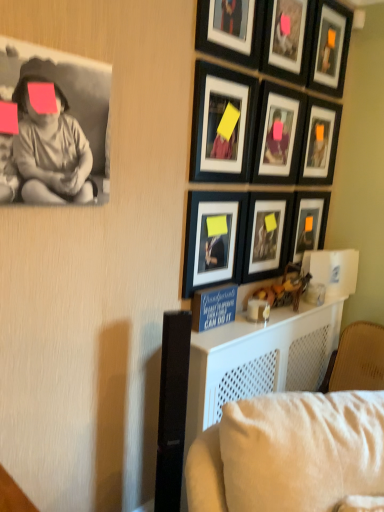
The height and width of the screenshot is (512, 384). In order to click on matte black picture frame at upper center, the sixth picture frame when ordered from top to bottom in this screenshot , I will do `click(219, 123)`.

Consider the image. How much space does matte black picture frame at center, acting as the 8th picture frame starting from the top, occupy horizontally?

It is 4.76 centimeters.

Measure the distance between point (327, 206) and camera.

Point (327, 206) is 2.43 meters from camera.

Describe the element at coordinates (51, 152) in the screenshot. I see `matte black photo of child at upper left` at that location.

The image size is (384, 512). In order to click on matte black picture frame at upper right, the ninth picture frame when ordered from bottom to top in this screenshot , I will do `click(330, 48)`.

What are the coordinates of `matte black picture frame at upper center, arranged as the fourth picture frame when ordered from the bottom` in the screenshot? It's located at (219, 123).

Between matte black picture frame at upper center, arranged as the fourth picture frame when ordered from the bottom, and matte black picture frame at center, acting as the 8th picture frame starting from the top, which one appears on the left side from the viewer's perspective?

matte black picture frame at upper center, arranged as the fourth picture frame when ordered from the bottom.

Is matte black picture frame at upper center, the sixth picture frame when ordered from top to bottom, aimed at matte black picture frame at center, positioned as the second picture frame in bottom-to-top order?

No, matte black picture frame at upper center, the sixth picture frame when ordered from top to bottom, is not oriented towards matte black picture frame at center, positioned as the second picture frame in bottom-to-top order.

Consider the image. Does matte black picture frame at upper center, arranged as the fourth picture frame when ordered from the bottom, touch matte black picture frame at center, positioned as the second picture frame in bottom-to-top order?

No.

In the scene shown: Is matte black picture frame at upper center, the sixth picture frame when ordered from top to bottom, shorter than matte black picture frame at center, positioned as the second picture frame in bottom-to-top order?

In fact, matte black picture frame at upper center, the sixth picture frame when ordered from top to bottom, may be taller than matte black picture frame at center, positioned as the second picture frame in bottom-to-top order.

Is point (300, 208) less distant than point (261, 252)?

No, it is not.

Choose the correct answer: Is matte black picture frame at center-right, acting as the seventh picture frame starting from the top, inside matte black picture frame at center, positioned as the second picture frame in bottom-to-top order, or outside it?

matte black picture frame at center-right, acting as the seventh picture frame starting from the top, lies outside matte black picture frame at center, positioned as the second picture frame in bottom-to-top order.

Which object is more forward, matte black picture frame at center-right, placed as the 3th picture frame when sorted from bottom to top, or matte black picture frame at center, acting as the 8th picture frame starting from the top?

matte black picture frame at center, acting as the 8th picture frame starting from the top, is closer to the camera.

Find the location of a particular element. The width and height of the screenshot is (384, 512). the 7th picture frame below the matte black picture frame at upper right, which ranks as the eighth picture frame in bottom-to-top order (from the image's perspective) is located at coordinates (213, 239).

Can you confirm if matte black picture frame at center, which is the 1th picture frame from bottom to top, is wider than matte black picture frame at upper right, placed as the 2th picture frame when sorted from top to bottom?

No, matte black picture frame at center, which is the 1th picture frame from bottom to top, is not wider than matte black picture frame at upper right, placed as the 2th picture frame when sorted from top to bottom.

Is matte black picture frame at center, the ninth picture frame when ordered from top to bottom, directly adjacent to matte black picture frame at upper right, placed as the 2th picture frame when sorted from top to bottom?

They are not placed beside each other.

Does matte black picture frame at center, the ninth picture frame when ordered from top to bottom, come behind matte black picture frame at upper right, which ranks as the eighth picture frame in bottom-to-top order?

No, it is in front of matte black picture frame at upper right, which ranks as the eighth picture frame in bottom-to-top order.

Consider the image. Is matte black picture frame at center-right, acting as the seventh picture frame starting from the top, in front of or behind matte black picture frame at center, the ninth picture frame when ordered from top to bottom, in the image?

matte black picture frame at center-right, acting as the seventh picture frame starting from the top, is positioned farther from the viewer than matte black picture frame at center, the ninth picture frame when ordered from top to bottom.

Could you measure the distance between matte black picture frame at center-right, placed as the 3th picture frame when sorted from bottom to top, and matte black picture frame at center, which is the 1th picture frame from bottom to top?

matte black picture frame at center-right, placed as the 3th picture frame when sorted from bottom to top, and matte black picture frame at center, which is the 1th picture frame from bottom to top, are 23.22 inches apart from each other.

From a real-world perspective, count 2nd picture frames upward from the matte black picture frame at center, which is the 1th picture frame from bottom to top, and point to it. Please provide its 2D coordinates.

[(308, 223)]

Considering the relative sizes of matte black picture frame at center-right, placed as the 3th picture frame when sorted from bottom to top, and matte black picture frame at center, which is the 1th picture frame from bottom to top, in the image provided, is matte black picture frame at center-right, placed as the 3th picture frame when sorted from bottom to top, bigger than matte black picture frame at center, which is the 1th picture frame from bottom to top,?

Actually, matte black picture frame at center-right, placed as the 3th picture frame when sorted from bottom to top, might be smaller than matte black picture frame at center, which is the 1th picture frame from bottom to top.

Is matte black picture frame at upper right, which ranks as the eighth picture frame in bottom-to-top order, touching matte black picture frame at upper right, which is counted as the 1th picture frame, starting from the top?

There is a gap between matte black picture frame at upper right, which ranks as the eighth picture frame in bottom-to-top order, and matte black picture frame at upper right, which is counted as the 1th picture frame, starting from the top.

Looking at this image, from a real-world perspective, is matte black picture frame at upper right, placed as the 2th picture frame when sorted from top to bottom, physically above matte black picture frame at upper right, which is counted as the 1th picture frame, starting from the top?

No, from a real-world perspective, matte black picture frame at upper right, placed as the 2th picture frame when sorted from top to bottom, is not above matte black picture frame at upper right, which is counted as the 1th picture frame, starting from the top.

Is matte black picture frame at upper right, which ranks as the eighth picture frame in bottom-to-top order, positioned with its back to matte black picture frame at upper right, the ninth picture frame when ordered from bottom to top?

matte black picture frame at upper right, which ranks as the eighth picture frame in bottom-to-top order, does not have its back to matte black picture frame at upper right, the ninth picture frame when ordered from bottom to top.

Can you tell me how much matte black picture frame at upper center, positioned as the 5th picture frame in top-to-bottom order, and matte black picture frame at upper right, which is the 6th picture frame in bottom-to-top order, differ in facing direction?

0.00331 degrees.

Based on the photo, could you tell me if matte black picture frame at upper center, positioned as the 5th picture frame in top-to-bottom order, is turned towards matte black picture frame at upper right, the 4th picture frame positioned from the top?

No, matte black picture frame at upper center, positioned as the 5th picture frame in top-to-bottom order, is not oriented towards matte black picture frame at upper right, the 4th picture frame positioned from the top.

From the image's perspective, which one is positioned lower, matte black picture frame at upper center, positioned as the 5th picture frame in top-to-bottom order, or matte black picture frame at upper right, the 4th picture frame positioned from the top?

From the image's view, matte black picture frame at upper center, positioned as the 5th picture frame in top-to-bottom order, is below.

Could you measure the distance between matte black picture frame at upper center, positioned as the 5th picture frame in top-to-bottom order, and matte black picture frame at upper right, the 4th picture frame positioned from the top?

8.06 inches.

What's the angular difference between matte black photo of child at upper left and matte black picture frame at upper right, the ninth picture frame when ordered from bottom to top,'s facing directions?

The angular difference between matte black photo of child at upper left and matte black picture frame at upper right, the ninth picture frame when ordered from bottom to top, is 2 degrees.

From the image's perspective, which object appears higher, matte black photo of child at upper left or matte black picture frame at upper right, which is counted as the 1th picture frame, starting from the top?

From the image's view, matte black picture frame at upper right, which is counted as the 1th picture frame, starting from the top, is above.

Considering the relative sizes of matte black photo of child at upper left and matte black picture frame at upper right, which is counted as the 1th picture frame, starting from the top, in the image provided, is matte black photo of child at upper left thinner than matte black picture frame at upper right, which is counted as the 1th picture frame, starting from the top,?

Yes.

Is the depth of matte black photo of child at upper left greater than that of matte black picture frame at upper right, the ninth picture frame when ordered from bottom to top?

That is False.

At what (x,y) coordinates should I click in order to perform the action: click on the 2nd picture frame positioned below the matte black picture frame at upper center, the sixth picture frame when ordered from top to bottom (from the image's perspective). Please return your answer as a coordinate pair (x, y). Image resolution: width=384 pixels, height=512 pixels. Looking at the image, I should click on (267, 234).

Locate an element on the screen. the 1st picture frame positioned above the matte black picture frame at center, positioned as the second picture frame in bottom-to-top order (from the image's perspective) is located at coordinates (308, 223).

Estimate the real-world distances between objects in this image. Which object is closer to matte black picture frame at upper right, which ranks as the eighth picture frame in bottom-to-top order, matte black picture frame at center-right, placed as the 3th picture frame when sorted from bottom to top, or matte black picture frame at upper center, the sixth picture frame when ordered from top to bottom?

The object closer to matte black picture frame at upper right, which ranks as the eighth picture frame in bottom-to-top order, is matte black picture frame at upper center, the sixth picture frame when ordered from top to bottom.

Looking at the image, which one is located closer to matte black picture frame at upper center, arranged as the fourth picture frame when ordered from the bottom, black matte picture frame at upper center, which ranks as the 7th picture frame in bottom-to-top order, or matte black picture frame at center, acting as the 8th picture frame starting from the top?

Among the two, black matte picture frame at upper center, which ranks as the 7th picture frame in bottom-to-top order, is located nearer to matte black picture frame at upper center, arranged as the fourth picture frame when ordered from the bottom.

Based on the photo, when comparing their distances from black matte picture frame at upper center, acting as the third picture frame starting from the top, does matte black picture frame at center, acting as the 8th picture frame starting from the top, or matte black picture frame at upper center, positioned as the 5th picture frame in top-to-bottom order, seem further?

matte black picture frame at center, acting as the 8th picture frame starting from the top, is further to black matte picture frame at upper center, acting as the third picture frame starting from the top.

Considering their positions, is matte black picture frame at upper right, the 4th picture frame positioned from the top, positioned further to matte black picture frame at upper right, the ninth picture frame when ordered from bottom to top, than matte black picture frame at center-right, placed as the 3th picture frame when sorted from bottom to top?

The object further to matte black picture frame at upper right, the ninth picture frame when ordered from bottom to top, is matte black picture frame at center-right, placed as the 3th picture frame when sorted from bottom to top.

From the image, which object appears to be farther from matte black photo of child at upper left, matte black picture frame at upper right, the 4th picture frame positioned from the top, or black matte picture frame at upper center, which ranks as the 7th picture frame in bottom-to-top order?

The object further to matte black photo of child at upper left is matte black picture frame at upper right, the 4th picture frame positioned from the top.

When comparing their distances from matte black picture frame at upper center, marked as the 5th picture frame in a bottom-to-top arrangement, does matte black picture frame at center-right, acting as the seventh picture frame starting from the top, or matte black picture frame at upper right, placed as the 2th picture frame when sorted from top to bottom, seem closer?

matte black picture frame at upper right, placed as the 2th picture frame when sorted from top to bottom, lies closer to matte black picture frame at upper center, marked as the 5th picture frame in a bottom-to-top arrangement, than the other object.

Looking at this image, estimate the real-world distances between objects in this image. Which object is further from matte black picture frame at upper right, the 4th picture frame positioned from the top, matte black picture frame at upper center, marked as the 5th picture frame in a bottom-to-top arrangement, or matte black picture frame at upper right, the ninth picture frame when ordered from bottom to top?

matte black picture frame at upper right, the ninth picture frame when ordered from bottom to top, is further to matte black picture frame at upper right, the 4th picture frame positioned from the top.

Which object lies nearer to the anchor point matte black picture frame at center, the ninth picture frame when ordered from top to bottom, matte black picture frame at upper right, which is counted as the 1th picture frame, starting from the top, or black matte picture frame at upper center, acting as the third picture frame starting from the top?

black matte picture frame at upper center, acting as the third picture frame starting from the top, is positioned closer to the anchor matte black picture frame at center, the ninth picture frame when ordered from top to bottom.

This screenshot has height=512, width=384. Find the location of `person between black matte picture frame at upper center, acting as the third picture frame starting from the top, and matte black picture frame at center, the ninth picture frame when ordered from top to bottom, in the vertical direction`. person between black matte picture frame at upper center, acting as the third picture frame starting from the top, and matte black picture frame at center, the ninth picture frame when ordered from top to bottom, in the vertical direction is located at coordinates (51, 152).

I want to click on person between matte black picture frame at upper right, which ranks as the eighth picture frame in bottom-to-top order, and matte black picture frame at center, the ninth picture frame when ordered from top to bottom, from top to bottom, so coord(51,152).